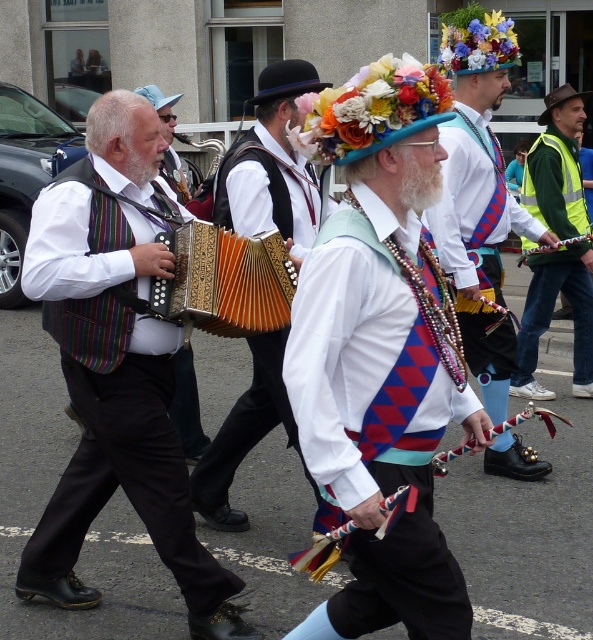
You are standing at the origin point in the image. Which of the two points, point (298, 90) or point (591, 396), is closer to you?

Point (298, 90) is in front of point (591, 396), so it is closer to you.

You are a photographer trying to capture a photo of the matte black accordion at center and the green reflective vest at right. Since you want both subjects to be in the frame, which object should you position closer to the camera to ensure both are visible?

The matte black accordion at center is positioned on the left side of green reflective vest at right. To ensure both are visible in the frame, position the green reflective vest at right closer to the camera so that the accordion at center can also be captured without cropping either subject.

Consider the image. You are a photographer standing in front of the striped fabric vest at left and the matte black accordion at center. You want to take a photo that captures both objects in the frame. Which object should you position closer to the camera to ensure both are fully visible?

The striped fabric vest at left is wider than the matte black accordion at center. To ensure both are fully visible in the photo, position the wider striped fabric vest at left closer to the camera. This will allow the narrower matte black accordion at center to fit within the frame while keeping the vest in focus.